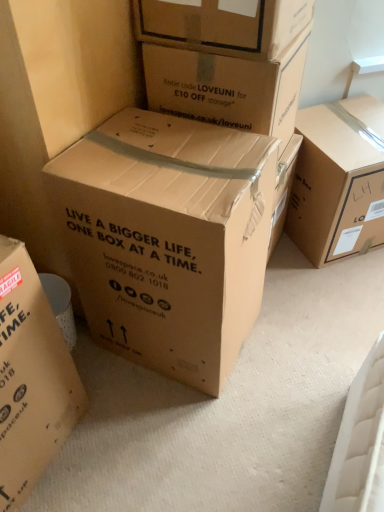
Identify the location of vacant area that lies to the right of brown cardboard box at center, which is the first box in left-to-right order. (118, 434).